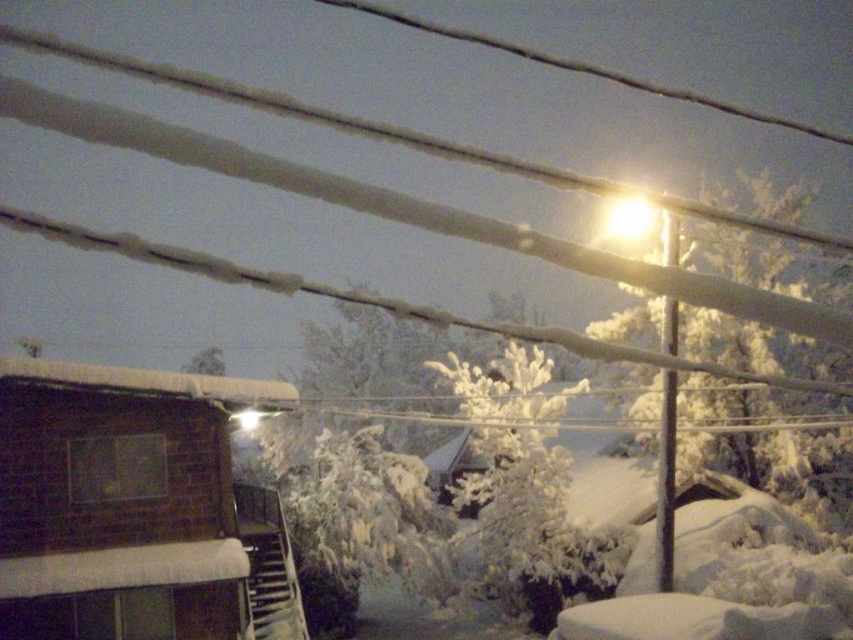
You are standing at the base of the stairs leading to the porch of the wooden cabin. You notice a point marked at coordinates (x=527, y=493) in the image. What object is located at that point?

The point at coordinates (x=527, y=493) indicates a white frosty tree at center.

You are standing at the base of the stairs leading to the wooden cabin porch. You want to take a photo of the white frosty tree at center from exactly 8 meters away. Can you take the photo from where you are standing?

The white frosty tree at center is 7.99 meters away from the camera, so yes, you can take the photo from your current position since it is just slightly under 8 meters.

You are standing on the porch of the wooden structure and want to walk towards the white frosty tree at upper right. Which direction should you walk relative to the white frosty tree at center?

You should walk to the right relative to the white frosty tree at center because the white frosty tree at upper right is located to the right of the white frosty tree at center.